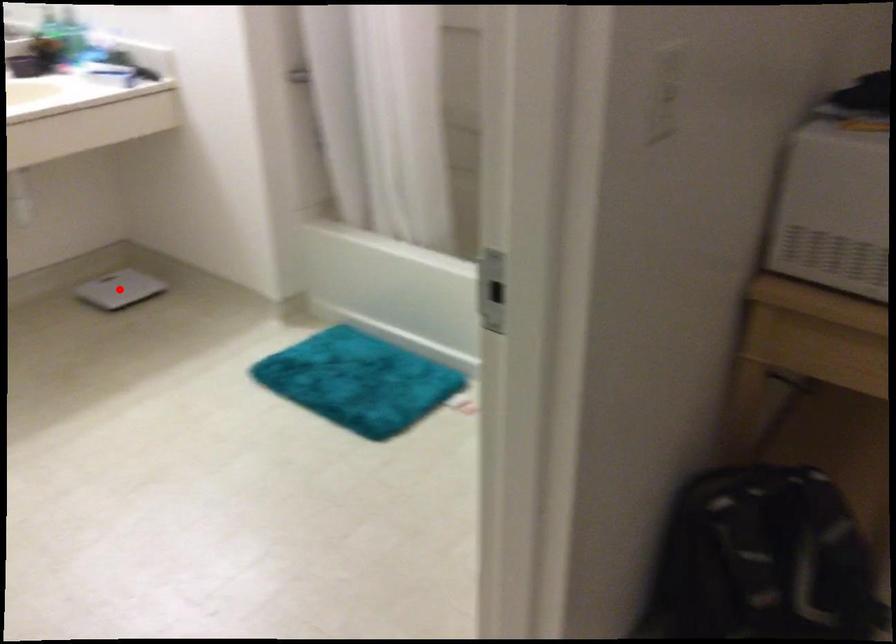
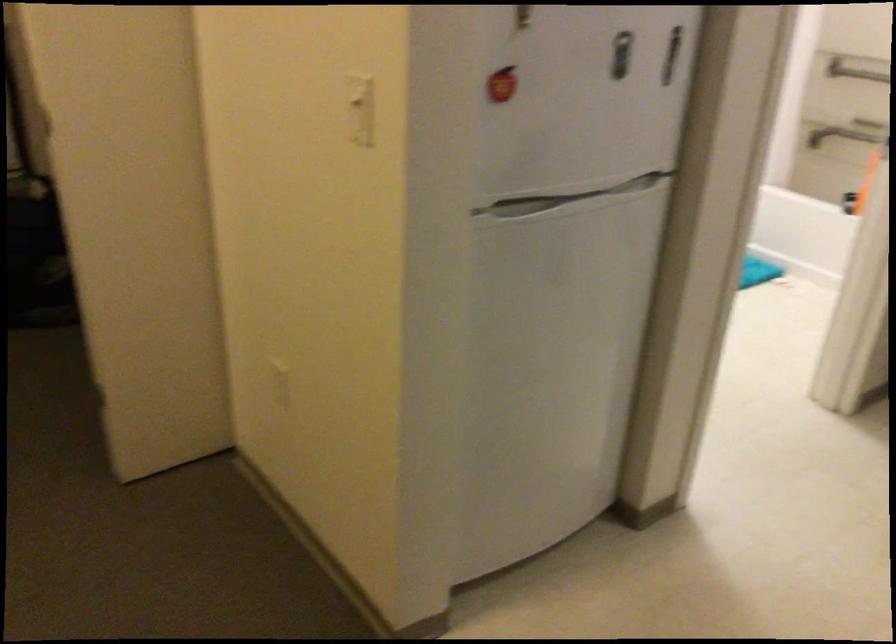
Question: I am providing you with two images of the same scene from different viewpoints. A red point is marked on the first image. Can you still see the location of the red point in image 2?

Choices:
 (A) Yes
 (B) No

Answer: (B)